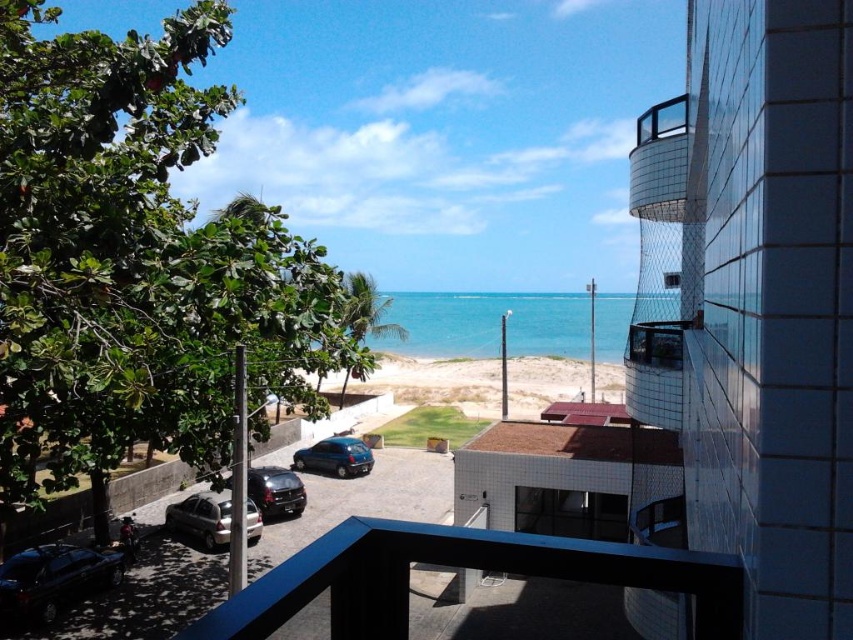
Is beige sand at center smaller than glassy metallic balcony at upper right?

Yes, beige sand at center is smaller than glassy metallic balcony at upper right.

The image size is (853, 640). Describe the element at coordinates (438, 381) in the screenshot. I see `beige sand at center` at that location.

Locate an element on the screen. beige sand at center is located at coordinates (438, 381).

From the picture: Can you confirm if glassy metallic balcony at upper right is bigger than satin silver car at lower left?

Yes, glassy metallic balcony at upper right is bigger than satin silver car at lower left.

Can you confirm if glassy metallic balcony at upper right is positioned to the left of satin silver car at lower left?

In fact, glassy metallic balcony at upper right is to the right of satin silver car at lower left.

Which is behind, point (659, 186) or point (216, 541)?

The point (216, 541) is behind.

In order to click on glassy metallic balcony at upper right in this screenshot , I will do `click(659, 161)`.

Who is positioned more to the right, satin silver car at lower left or shiny dark blue hatchback at center?

shiny dark blue hatchback at center

Between point (173, 529) and point (346, 460), which one is positioned behind?

Positioned behind is point (346, 460).

Between point (189, 515) and point (352, 476), which one is positioned in front?

Point (189, 515) is in front.

Locate an element on the screen. The width and height of the screenshot is (853, 640). satin silver car at lower left is located at coordinates (202, 516).